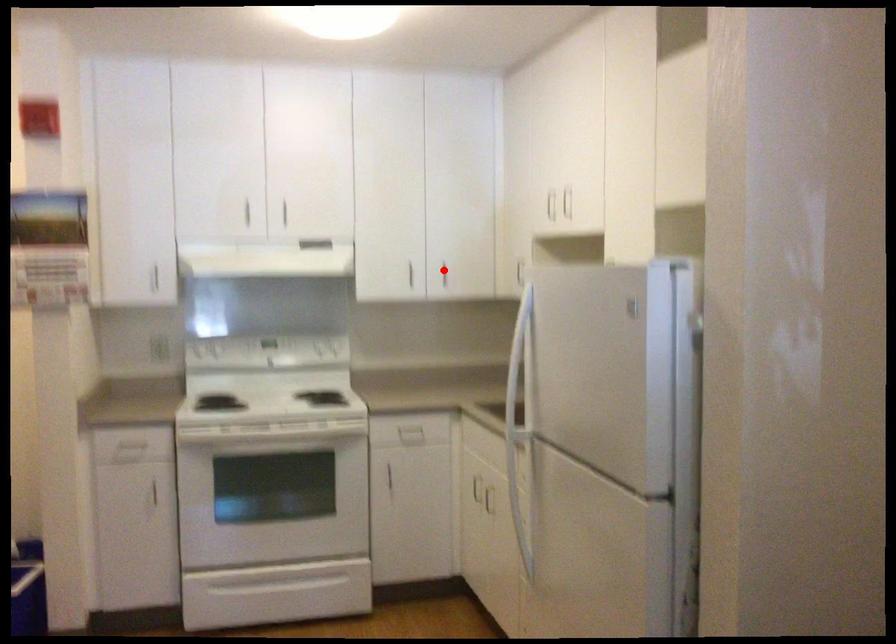
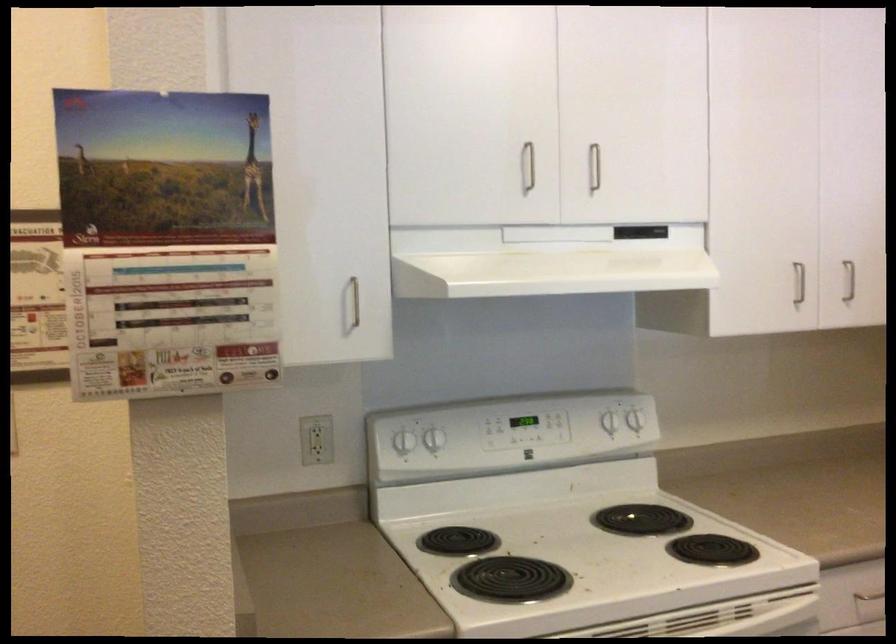
Where in the second image is the point corresponding to the highlighted location from the first image?

(849, 281)